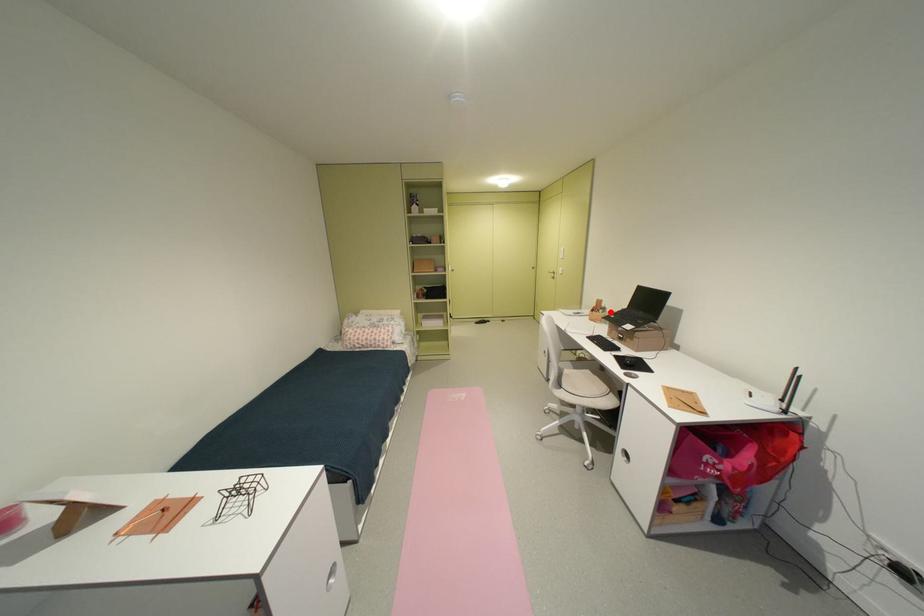
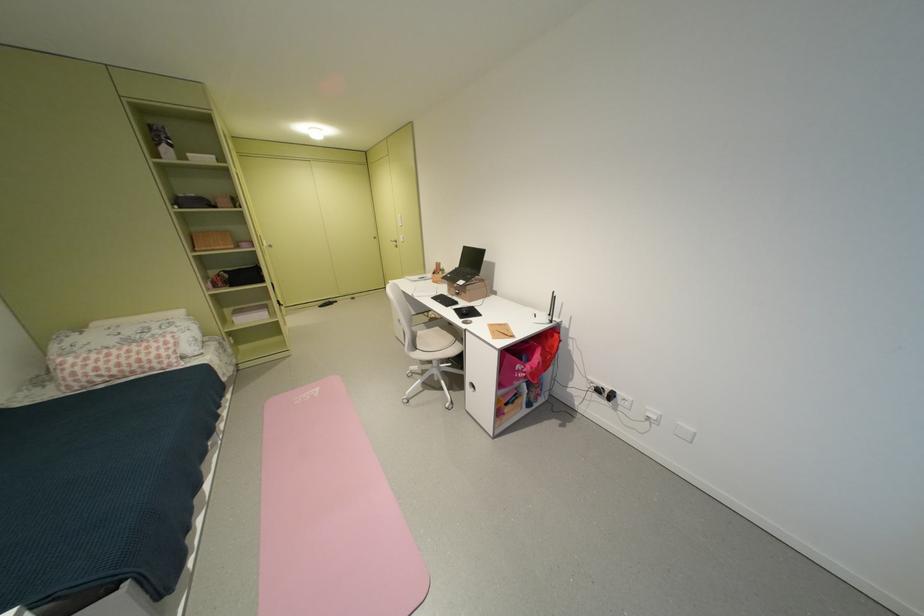
Question: I am providing you with two images of the same scene from different viewpoints. Image1 has a red point marked. In image2, the corresponding 3D location appears at what relative position? Reply with the corresponding letter.

Choices:
 (A) Closer
 (B) Farther

Answer: (B)